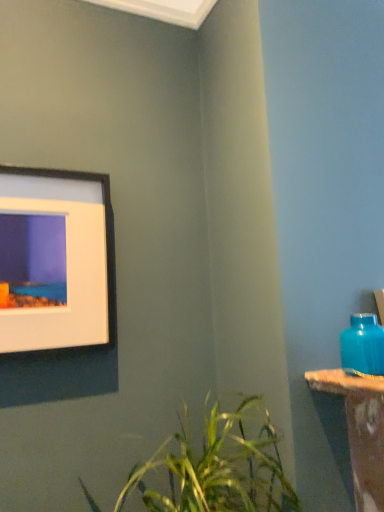
What do you see at coordinates (55, 259) in the screenshot? I see `black matte picture frame at upper left` at bounding box center [55, 259].

Where is `black matte picture frame at upper left`? This screenshot has height=512, width=384. black matte picture frame at upper left is located at coordinates (55, 259).

From the picture: What is the approximate height of matte blue vase at right?

matte blue vase at right is 5.46 inches tall.

Image resolution: width=384 pixels, height=512 pixels. What do you see at coordinates (363, 346) in the screenshot?
I see `matte blue vase at right` at bounding box center [363, 346].

Locate an element on the screen. matte blue vase at right is located at coordinates [x=363, y=346].

Identify the location of black matte picture frame at upper left. (55, 259).

Between matte blue vase at right and black matte picture frame at upper left, which one appears on the left side from the viewer's perspective?

black matte picture frame at upper left.

Is matte blue vase at right positioned behind black matte picture frame at upper left?

No, it is in front of black matte picture frame at upper left.

Which is less distant, [376,353] or [73,300]?

Clearly, point [376,353] is closer to the camera than point [73,300].

From the picture: From the image's perspective, is matte blue vase at right positioned above or below black matte picture frame at upper left?

From the image's perspective, matte blue vase at right appears below black matte picture frame at upper left.

Based on the photo, from a real-world perspective, is matte blue vase at right physically below black matte picture frame at upper left?

Yes, from a real-world perspective, matte blue vase at right is under black matte picture frame at upper left.

Considering the sizes of objects matte blue vase at right and black matte picture frame at upper left in the image provided, who is thinner, matte blue vase at right or black matte picture frame at upper left?

black matte picture frame at upper left is thinner.

Which of these two, matte blue vase at right or black matte picture frame at upper left, stands shorter?

matte blue vase at right.

Considering the sizes of objects matte blue vase at right and black matte picture frame at upper left in the image provided, who is bigger, matte blue vase at right or black matte picture frame at upper left?

With larger size is black matte picture frame at upper left.

Is matte blue vase at right positioned beyond the bounds of black matte picture frame at upper left?

Absolutely, matte blue vase at right is external to black matte picture frame at upper left.

Is matte blue vase at right next to black matte picture frame at upper left and touching it?

No, matte blue vase at right is not beside black matte picture frame at upper left.

Is matte blue vase at right positioned with its back to black matte picture frame at upper left?

No.

Can you tell me how much matte blue vase at right and black matte picture frame at upper left differ in facing direction?

matte blue vase at right and black matte picture frame at upper left are facing 1.02 degrees away from each other.

Locate an element on the screen. bottle below the black matte picture frame at upper left (from the image's perspective) is located at coordinates (363, 346).

Considering the relative positions of black matte picture frame at upper left and matte blue vase at right in the image provided, is black matte picture frame at upper left to the left of matte blue vase at right from the viewer's perspective?

Yes.

In the scene shown: Relative to matte blue vase at right, is black matte picture frame at upper left in front or behind?

black matte picture frame at upper left is positioned farther from the viewer than matte blue vase at right.

Which point is more distant from viewer, (103,185) or (343,367)?

The point (103,185) is farther.

From the image's perspective, is black matte picture frame at upper left on matte blue vase at right?

Yes, from the image's perspective, black matte picture frame at upper left is on top of matte blue vase at right.

In the scene shown: From a real-world perspective, is black matte picture frame at upper left located beneath matte blue vase at right?

No.

Between black matte picture frame at upper left and matte blue vase at right, which one has larger width?

With larger width is matte blue vase at right.

Between black matte picture frame at upper left and matte blue vase at right, which one has more height?

black matte picture frame at upper left.

Considering the relative sizes of black matte picture frame at upper left and matte blue vase at right in the image provided, is black matte picture frame at upper left bigger than matte blue vase at right?

Yes.

Is black matte picture frame at upper left surrounding matte blue vase at right?

No, black matte picture frame at upper left does not contain matte blue vase at right.

Can you see black matte picture frame at upper left touching matte blue vase at right?

There is a gap between black matte picture frame at upper left and matte blue vase at right.

Could you tell me if black matte picture frame at upper left is facing matte blue vase at right?

No.

Based on the photo, what's the angular difference between black matte picture frame at upper left and matte blue vase at right's facing directions?

They differ by 1.02 degrees in their facing directions.

Identify the location of picture frame lying above the matte blue vase at right (from the image's perspective). This screenshot has height=512, width=384. (55, 259).

Where is `bottle in front of the black matte picture frame at upper left`? The height and width of the screenshot is (512, 384). bottle in front of the black matte picture frame at upper left is located at coordinates (363, 346).

This screenshot has height=512, width=384. Find the location of `picture frame that appears on the left of matte blue vase at right`. picture frame that appears on the left of matte blue vase at right is located at coordinates (55, 259).